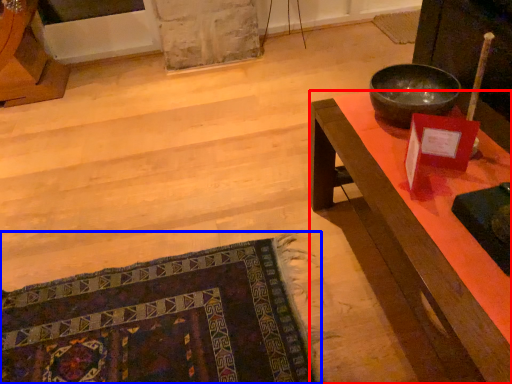
Question: Which of the following is the closest to the observer, desk (highlighted by a red box) or mat (highlighted by a blue box)?

Choices:
 (A) desk
 (B) mat

Answer: (A)